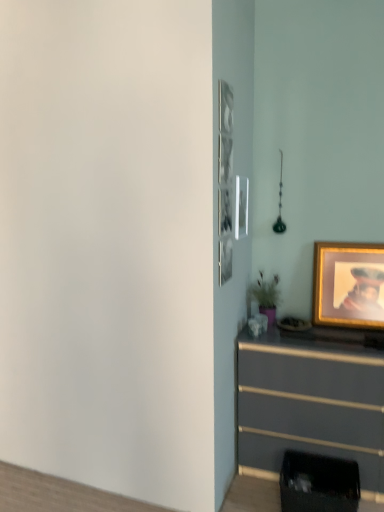
This screenshot has width=384, height=512. Find the location of `matte gray chest of drawers at lower right`. matte gray chest of drawers at lower right is located at coordinates (311, 401).

The width and height of the screenshot is (384, 512). What do you see at coordinates (311, 401) in the screenshot?
I see `matte gray chest of drawers at lower right` at bounding box center [311, 401].

In the scene shown: What is the approximate height of gold-framed picture at right?

19.90 inches.

The height and width of the screenshot is (512, 384). I want to click on gold-framed picture at right, so click(348, 285).

The height and width of the screenshot is (512, 384). Describe the element at coordinates (348, 285) in the screenshot. I see `gold-framed picture at right` at that location.

Locate an element on the screen. The height and width of the screenshot is (512, 384). matte gray chest of drawers at lower right is located at coordinates (311, 401).

Can you confirm if matte gray chest of drawers at lower right is positioned to the left of gold-framed picture at right?

Yes, matte gray chest of drawers at lower right is to the left of gold-framed picture at right.

In the scene shown: Does matte gray chest of drawers at lower right come in front of gold-framed picture at right?

Yes, the depth of matte gray chest of drawers at lower right is less than that of gold-framed picture at right.

Is point (249, 400) closer to viewer compared to point (319, 302)?

Yes, it is.

From the image's perspective, which object appears higher, matte gray chest of drawers at lower right or gold-framed picture at right?

gold-framed picture at right, from the image's perspective.

From a real-world perspective, is matte gray chest of drawers at lower right on gold-framed picture at right?

No, from a real-world perspective, matte gray chest of drawers at lower right is not above gold-framed picture at right.

In terms of width, does matte gray chest of drawers at lower right look wider or thinner when compared to gold-framed picture at right?

matte gray chest of drawers at lower right is wider than gold-framed picture at right.

Considering the relative sizes of matte gray chest of drawers at lower right and gold-framed picture at right in the image provided, is matte gray chest of drawers at lower right taller than gold-framed picture at right?

Correct, matte gray chest of drawers at lower right is much taller as gold-framed picture at right.

Does matte gray chest of drawers at lower right have a smaller size compared to gold-framed picture at right?

Actually, matte gray chest of drawers at lower right might be larger than gold-framed picture at right.

Based on the photo, is matte gray chest of drawers at lower right inside or outside of gold-framed picture at right?

matte gray chest of drawers at lower right is spatially situated outside gold-framed picture at right.

Are matte gray chest of drawers at lower right and gold-framed picture at right located far from each other?

No, matte gray chest of drawers at lower right is not far from gold-framed picture at right.

Is matte gray chest of drawers at lower right positioned with its back to gold-framed picture at right?

No, matte gray chest of drawers at lower right is not facing the opposite direction of gold-framed picture at right.

Identify the location of chest of drawers lying on the left of gold-framed picture at right. (311, 401).

Can you confirm if gold-framed picture at right is positioned to the right of matte gray chest of drawers at lower right?

Indeed, gold-framed picture at right is positioned on the right side of matte gray chest of drawers at lower right.

Who is more distant, gold-framed picture at right or matte gray chest of drawers at lower right?

gold-framed picture at right is further from the camera.

Is point (369, 304) behind point (329, 343)?

Yes, it is.

From the image's perspective, between gold-framed picture at right and matte gray chest of drawers at lower right, which one is located above?

gold-framed picture at right is shown above in the image.

From a real-world perspective, is gold-framed picture at right positioned under matte gray chest of drawers at lower right based on gravity?

No, from a real-world perspective, gold-framed picture at right is not beneath matte gray chest of drawers at lower right.

Which object is thinner, gold-framed picture at right or matte gray chest of drawers at lower right?

gold-framed picture at right is thinner.

Considering the sizes of objects gold-framed picture at right and matte gray chest of drawers at lower right in the image provided, who is taller, gold-framed picture at right or matte gray chest of drawers at lower right?

matte gray chest of drawers at lower right.

Based on their sizes in the image, would you say gold-framed picture at right is bigger or smaller than matte gray chest of drawers at lower right?

In the image, gold-framed picture at right appears to be smaller than matte gray chest of drawers at lower right.

Choose the correct answer: Is gold-framed picture at right inside matte gray chest of drawers at lower right or outside it?

gold-framed picture at right is spatially situated outside matte gray chest of drawers at lower right.

Would you say gold-framed picture at right is a long distance from matte gray chest of drawers at lower right?

No, gold-framed picture at right is not far away from matte gray chest of drawers at lower right.

Is gold-framed picture at right facing away from matte gray chest of drawers at lower right?

No.

Consider the image. How different are the orientations of gold-framed picture at right and matte gray chest of drawers at lower right in degrees?

The angle between the facing direction of gold-framed picture at right and the facing direction of matte gray chest of drawers at lower right is 0.104 degrees.

How far apart are gold-framed picture at right and matte gray chest of drawers at lower right?

gold-framed picture at right and matte gray chest of drawers at lower right are 18.53 inches apart from each other.

The image size is (384, 512). I want to click on picture frame that appears behind the matte gray chest of drawers at lower right, so click(348, 285).

I want to click on the chest of drawers below the gold-framed picture at right (from a real-world perspective), so click(x=311, y=401).

Locate an element on the screen. The width and height of the screenshot is (384, 512). chest of drawers below the gold-framed picture at right (from the image's perspective) is located at coordinates (x=311, y=401).